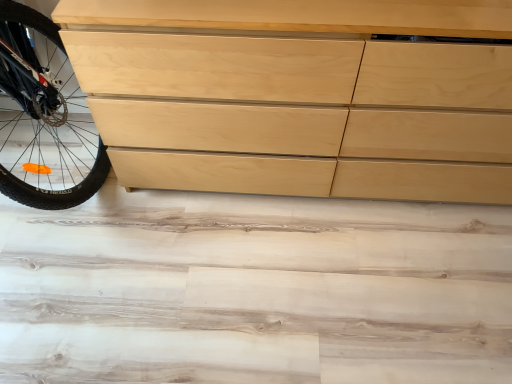
The width and height of the screenshot is (512, 384). Describe the element at coordinates (257, 293) in the screenshot. I see `wooden dresser at upper left` at that location.

This screenshot has height=384, width=512. What are the coordinates of `wooden dresser at upper left` in the screenshot? It's located at (257, 293).

What do you see at coordinates (300, 95) in the screenshot?
I see `natural wood chest of drawers at left` at bounding box center [300, 95].

This screenshot has height=384, width=512. What are the coordinates of `natural wood chest of drawers at left` in the screenshot? It's located at (300, 95).

Identify the location of wooden dresser at upper left. (257, 293).

Can you confirm if wooden dresser at upper left is positioned to the left of natural wood chest of drawers at left?

Correct, you'll find wooden dresser at upper left to the left of natural wood chest of drawers at left.

Is wooden dresser at upper left in front of or behind natural wood chest of drawers at left in the image?

wooden dresser at upper left is behind natural wood chest of drawers at left.

Which point is more forward, (49,270) or (453,28)?

Point (453,28)

From the image's perspective, relative to natural wood chest of drawers at left, is wooden dresser at upper left above or below?

wooden dresser at upper left is situated lower than natural wood chest of drawers at left in the image.

Consider the image. From a real-world perspective, which is physically above, wooden dresser at upper left or natural wood chest of drawers at left?

In real-world perspective, natural wood chest of drawers at left is above.

Is wooden dresser at upper left thinner than natural wood chest of drawers at left?

In fact, wooden dresser at upper left might be wider than natural wood chest of drawers at left.

In the scene shown: Can you confirm if wooden dresser at upper left is shorter than natural wood chest of drawers at left?

Yes, wooden dresser at upper left is shorter than natural wood chest of drawers at left.

Which of these two, wooden dresser at upper left or natural wood chest of drawers at left, is bigger?

natural wood chest of drawers at left is bigger.

Choose the correct answer: Is wooden dresser at upper left inside natural wood chest of drawers at left or outside it?

wooden dresser at upper left is not inside natural wood chest of drawers at left, it's outside.

Is the surface of wooden dresser at upper left in direct contact with natural wood chest of drawers at left?

wooden dresser at upper left and natural wood chest of drawers at left are clearly separated.

Is wooden dresser at upper left positioned with its back to natural wood chest of drawers at left?

wooden dresser at upper left is not turned away from natural wood chest of drawers at left.

I want to click on chest of drawers on the right of the wooden dresser at upper left, so click(300, 95).

In the image, is natural wood chest of drawers at left on the left side or the right side of wooden dresser at upper left?

In the image, natural wood chest of drawers at left appears on the right side of wooden dresser at upper left.

Relative to wooden dresser at upper left, is natural wood chest of drawers at left in front or behind?

Visually, natural wood chest of drawers at left is located in front of wooden dresser at upper left.

Considering the positions of point (172, 183) and point (131, 340), is point (172, 183) closer or farther from the camera than point (131, 340)?

Point (172, 183) appears to be farther away from the viewer than point (131, 340).

Consider the image. From the image's perspective, is natural wood chest of drawers at left located above or below wooden dresser at upper left?

Based on their image positions, natural wood chest of drawers at left is located above wooden dresser at upper left.

From a real-world perspective, is natural wood chest of drawers at left over wooden dresser at upper left?

Yes, from a real-world perspective, natural wood chest of drawers at left is above wooden dresser at upper left.

Can you confirm if natural wood chest of drawers at left is wider than wooden dresser at upper left?

No, natural wood chest of drawers at left is not wider than wooden dresser at upper left.

Considering the sizes of natural wood chest of drawers at left and wooden dresser at upper left in the image, is natural wood chest of drawers at left taller or shorter than wooden dresser at upper left?

Clearly, natural wood chest of drawers at left is taller compared to wooden dresser at upper left.

Between natural wood chest of drawers at left and wooden dresser at upper left, which one has smaller size?

wooden dresser at upper left.

Is natural wood chest of drawers at left inside or outside of wooden dresser at upper left?

natural wood chest of drawers at left is outside wooden dresser at upper left.

Is there a large distance between natural wood chest of drawers at left and wooden dresser at upper left?

They are positioned close to each other.

Is natural wood chest of drawers at left facing towards wooden dresser at upper left?

Yes, natural wood chest of drawers at left is facing wooden dresser at upper left.

How many degrees apart are the facing directions of natural wood chest of drawers at left and wooden dresser at upper left?

The angular difference between natural wood chest of drawers at left and wooden dresser at upper left is 89.6 degrees.

Measure the distance from natural wood chest of drawers at left to wooden dresser at upper left.

natural wood chest of drawers at left and wooden dresser at upper left are 42.00 centimeters apart from each other.

Locate an element on the screen. The height and width of the screenshot is (384, 512). stair directly beneath the natural wood chest of drawers at left (from a real-world perspective) is located at coordinates (257, 293).

Locate an element on the screen. The width and height of the screenshot is (512, 384). the chest of drawers above the wooden dresser at upper left (from the image's perspective) is located at coordinates (300, 95).

Identify the location of chest of drawers to the right of wooden dresser at upper left. This screenshot has height=384, width=512. (300, 95).